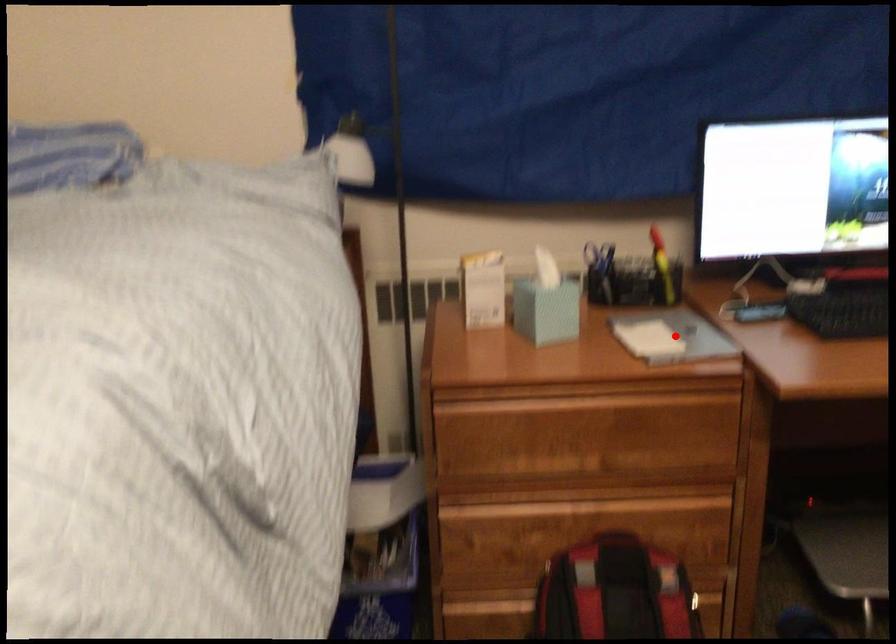
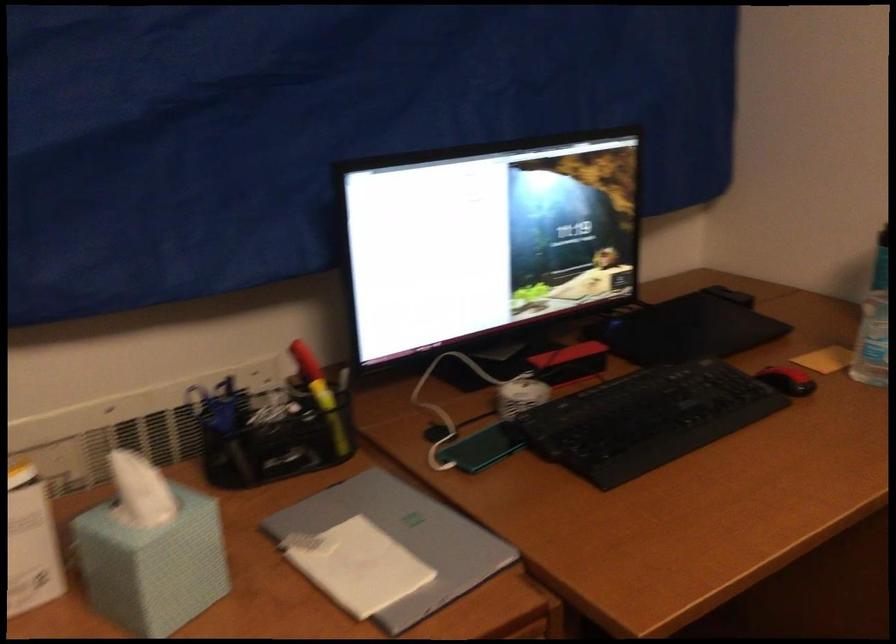
Where in the second image is the point corresponding to the highlighted location from the first image?

(403, 538)